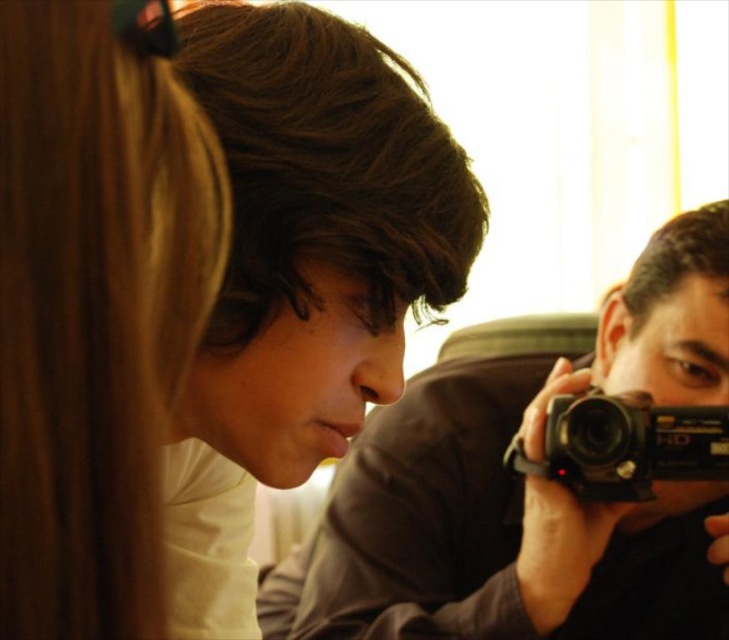
Is smooth brown hair at center shorter than black plastic camera at right?

No, smooth brown hair at center is not shorter than black plastic camera at right.

Measure the distance between point (281, 269) and camera.

Point (281, 269) and camera are 41.58 centimeters apart.

Identify the location of smooth brown hair at center. This screenshot has width=729, height=640. (300, 273).

Is smooth blonde hair at upper left smaller than matte black camera at center?

Indeed, smooth blonde hair at upper left has a smaller size compared to matte black camera at center.

Does point (106, 490) lie in front of point (697, 275)?

Yes.

Where is `smooth blonde hair at upper left`? This screenshot has width=729, height=640. smooth blonde hair at upper left is located at coordinates (93, 307).

Between smooth blonde hair at upper left and black plastic camera at right, which one appears on the right side from the viewer's perspective?

black plastic camera at right

Between smooth blonde hair at upper left and black plastic camera at right, which one appears on the left side from the viewer's perspective?

smooth blonde hair at upper left is more to the left.

Is point (34, 35) positioned before point (607, 404)?

Yes, it is.

The height and width of the screenshot is (640, 729). I want to click on smooth blonde hair at upper left, so click(93, 307).